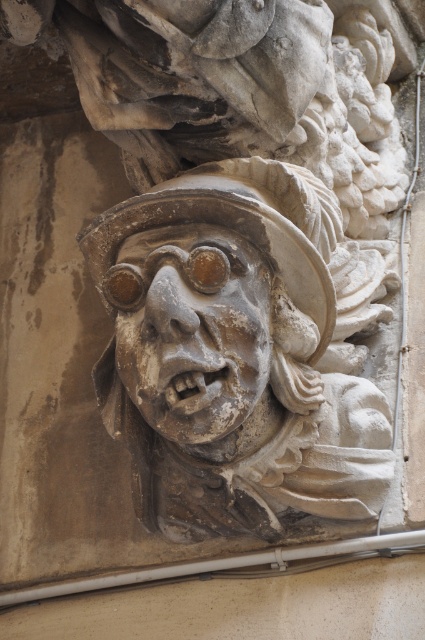
You are an architect examining a stone sculpture. You notice a point marked at coordinates (232,355). Based on the scene description, what significant feature does this point likely correspond to?

The point at coordinates (232,355) marks the stone carved face at center, which is the focal point of the sculpture with exaggerated features like large eyes and an open mouth.

You are an art conservator examining the sculpture. You notice two faces in the sculpture, the stone carved face at center and the gray stone face at center. Which one has a greater height?

The stone carved face at center is taller than the gray stone face at center.